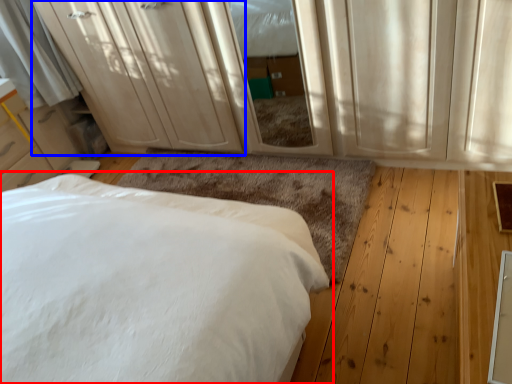
Question: Which of the following is the farthest to the observer, bed (highlighted by a red box) or dresser (highlighted by a blue box)?

Choices:
 (A) bed
 (B) dresser

Answer: (B)